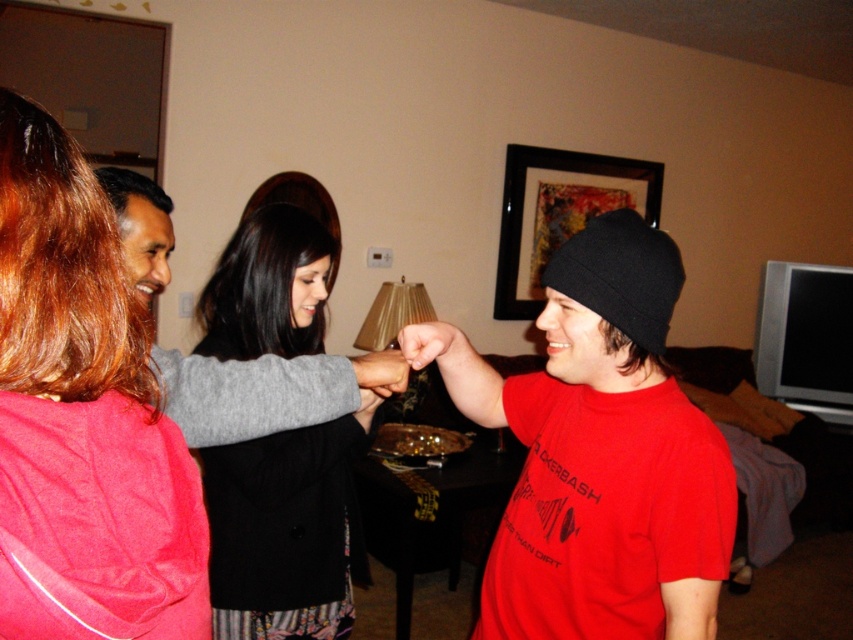
Is red matte beanie at center to the left of black matte jacket at center from the viewer's perspective?

No, red matte beanie at center is not to the left of black matte jacket at center.

Is point (572, 320) positioned before point (321, 259)?

Yes, it is.

Who is more forward, (538, 493) or (229, 554)?

Positioned in front is point (538, 493).

Identify the location of red matte beanie at center. (605, 458).

Is smooth skin hand at center closer to camera compared to matte black hand at center?

That is False.

This screenshot has height=640, width=853. Describe the element at coordinates (437, 348) in the screenshot. I see `smooth skin hand at center` at that location.

Describe the element at coordinates (437, 348) in the screenshot. The width and height of the screenshot is (853, 640). I see `smooth skin hand at center` at that location.

You are a GUI agent. You are given a task and a screenshot of the screen. Output one action in this format:
    pyautogui.click(x=<x>, y=<y>)
    Task: Click on the smooth skin hand at center
    This screenshot has width=853, height=640.
    Given the screenshot: What is the action you would take?
    pyautogui.click(x=437, y=348)

Is matte pink hoodie at upper left behind smooth skin hand at center?

No, it is in front of smooth skin hand at center.

Between matte pink hoodie at upper left and smooth skin hand at center, which one is positioned lower?

smooth skin hand at center

The height and width of the screenshot is (640, 853). What do you see at coordinates (83, 417) in the screenshot?
I see `matte pink hoodie at upper left` at bounding box center [83, 417].

This screenshot has height=640, width=853. I want to click on matte pink hoodie at upper left, so click(83, 417).